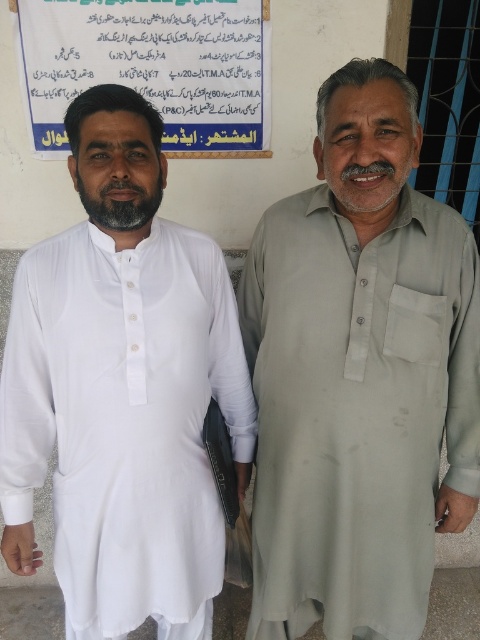
Is light gray cotton shirt at right bigger than blue paper at upper center?

Result: Yes, light gray cotton shirt at right is bigger than blue paper at upper center.

Is light gray cotton shirt at right taller than blue paper at upper center?

Indeed, light gray cotton shirt at right has a greater height compared to blue paper at upper center.

Where is `light gray cotton shirt at right`? light gray cotton shirt at right is located at coordinates (360, 374).

At what (x,y) coordinates should I click in order to perform the action: click on light gray cotton shirt at right. Please return your answer as a coordinate pair (x, y). Looking at the image, I should click on (360, 374).

Can you confirm if white cotton shirt at left is thinner than blue paper at upper center?

Correct, white cotton shirt at left's width is less than blue paper at upper center's.

Which is in front, point (91, 624) or point (52, 138)?

Point (91, 624) is in front.

Is point (63, 416) positioned in front of point (100, 49)?

Yes, it is.

This screenshot has height=640, width=480. In order to click on white cotton shirt at left in this screenshot , I will do `click(122, 388)`.

Does light gray cotton shirt at right have a lesser height compared to white cotton shirt at left?

No, light gray cotton shirt at right is not shorter than white cotton shirt at left.

Is point (339, 422) behind point (92, 352)?

Yes.

Is point (336, 577) in front of point (24, 509)?

That is False.

At what (x,y) coordinates should I click in order to perform the action: click on light gray cotton shirt at right. Please return your answer as a coordinate pair (x, y). Looking at the image, I should click on (360, 374).